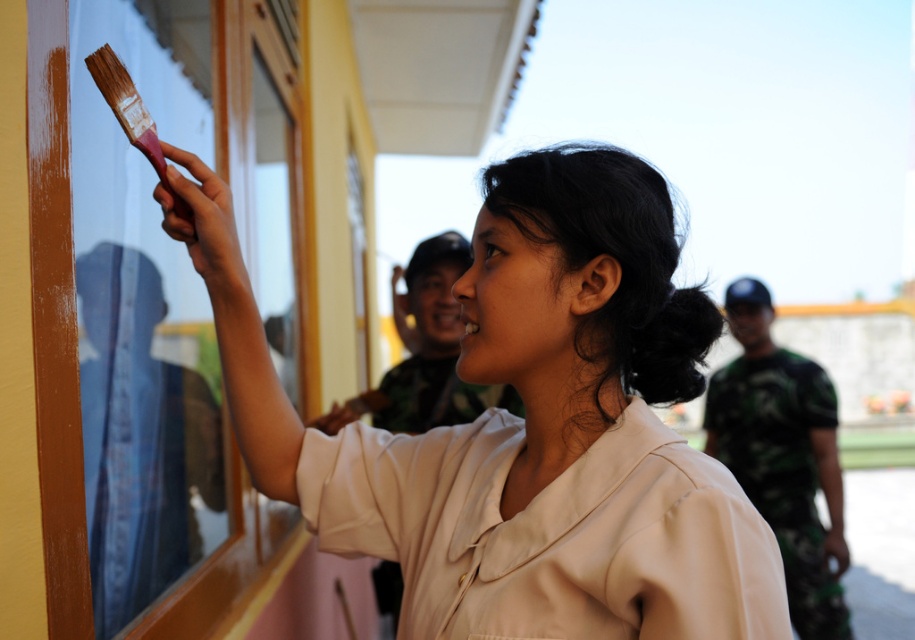
Question: Is camouflage fabric uniform at right below pink wooden paintbrush at upper left?

Choices:
 (A) no
 (B) yes

Answer: (B)

Question: Which of the following is the closest to the observer?

Choices:
 (A) matte beige shirt at upper center
 (B) camouflage fabric uniform at upper center
 (C) camouflage fabric uniform at right
 (D) pink wooden paintbrush at upper left

Answer: (A)

Question: Is matte beige shirt at upper center to the right of camouflage fabric uniform at right from the viewer's perspective?

Choices:
 (A) no
 (B) yes

Answer: (A)

Question: Which object is farther from the camera taking this photo?

Choices:
 (A) camouflage fabric uniform at right
 (B) camouflage fabric uniform at upper center
 (C) pink wooden paintbrush at upper left

Answer: (A)

Question: Can you confirm if camouflage fabric uniform at right is smaller than pink wooden paintbrush at upper left?

Choices:
 (A) no
 (B) yes

Answer: (A)

Question: Which of these objects is positioned farthest from the pink wooden paintbrush at upper left?

Choices:
 (A) matte beige shirt at upper center
 (B) camouflage fabric uniform at upper center

Answer: (B)